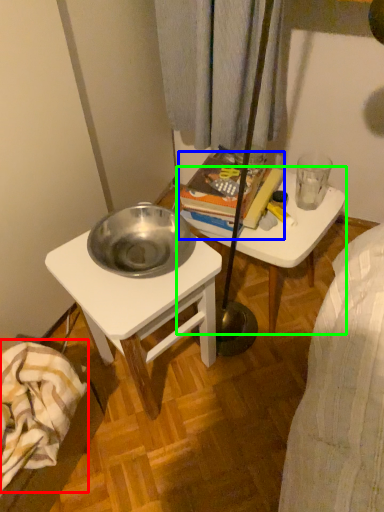
Question: Considering the real-world distances, which object is closest to blanket (highlighted by a red box)? book (highlighted by a blue box) or table (highlighted by a green box).

Choices:
 (A) book
 (B) table

Answer: (A)